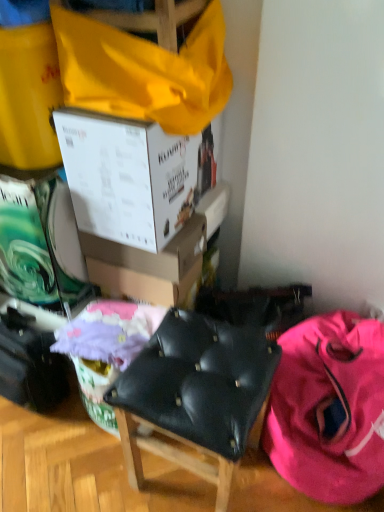
Question: Based on their sizes in the image, would you say pink fabric backpack at lower right is bigger or smaller than white cardboard box at upper center, the 1th box positioned from the bottom?

Choices:
 (A) big
 (B) small

Answer: (A)

Question: Would you say pink fabric backpack at lower right is inside or outside white cardboard box at upper center, the 1th box positioned from the bottom?

Choices:
 (A) inside
 (B) outside

Answer: (B)

Question: Estimate the real-world distances between objects in this image. Which object is farther from the black leather chair at center?

Choices:
 (A) pink fabric backpack at lower right
 (B) pastel pink fabric at center
 (C) white cardboard box at upper center, positioned as the 1th box in top-to-bottom order
 (D) white cardboard box at upper center, the 1th box positioned from the bottom

Answer: (C)

Question: Based on their relative distances, which object is nearer to the black leather chair at center?

Choices:
 (A) white cardboard box at upper center, positioned as the 1th box in top-to-bottom order
 (B) pink fabric backpack at lower right
 (C) white cardboard box at upper center, arranged as the second box when viewed from the top
 (D) pastel pink fabric at center

Answer: (B)